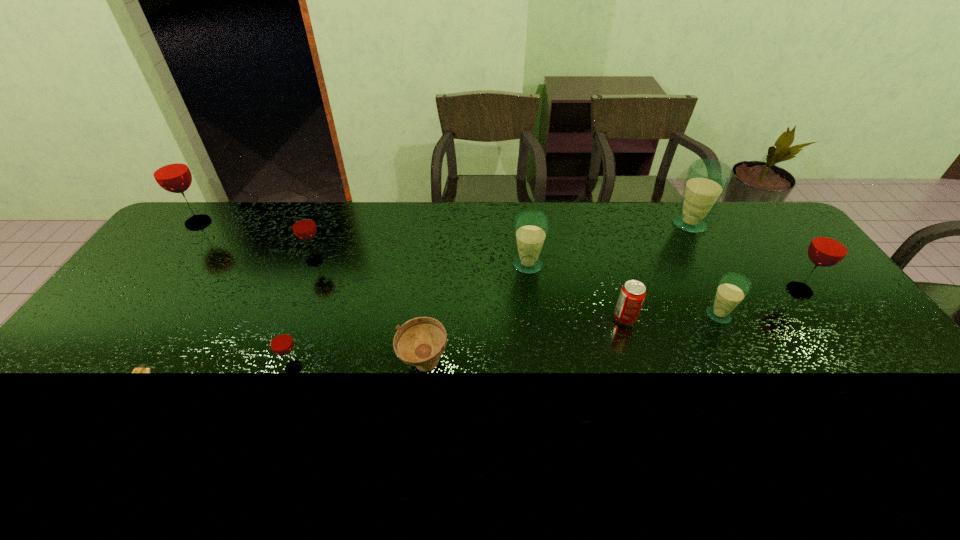
The height and width of the screenshot is (540, 960). What are the coordinates of `the leftmost red glass` in the screenshot? It's located at (170, 171).

At what (x,y) coordinates should I click in order to perform the action: click on the tallest object. Please return your answer as a coordinate pair (x, y). The width and height of the screenshot is (960, 540). Looking at the image, I should click on (170, 171).

You are a GUI agent. You are given a task and a screenshot of the screen. Output one action in this format:
    pyautogui.click(x=<x>, y=<y>)
    Task: Click on the fifth farthest object
    This screenshot has width=960, height=540.
    Given the screenshot: What is the action you would take?
    pyautogui.click(x=830, y=246)

At what (x,y) coordinates should I click in order to perform the action: click on the fifth farthest glass. Please return your answer as a coordinate pair (x, y). Looking at the image, I should click on 830,246.

Locate an element on the screen. The height and width of the screenshot is (540, 960). the biggest blue glass is located at coordinates (707, 179).

This screenshot has height=540, width=960. I want to click on the second smallest red glass, so click(303, 225).

Locate an element on the screen. This screenshot has width=960, height=540. the second smallest blue glass is located at coordinates (531, 227).

Where is `the second nearest blue glass`? The height and width of the screenshot is (540, 960). the second nearest blue glass is located at coordinates (531, 227).

The image size is (960, 540). In order to click on the second nearest glass in this screenshot , I will do `click(732, 289)`.

You are a GUI agent. You are given a task and a screenshot of the screen. Output one action in this format:
    pyautogui.click(x=<x>, y=<y>)
    Task: Click on the smallest blue glass
    This screenshot has width=960, height=540.
    Given the screenshot: What is the action you would take?
    [732, 289]